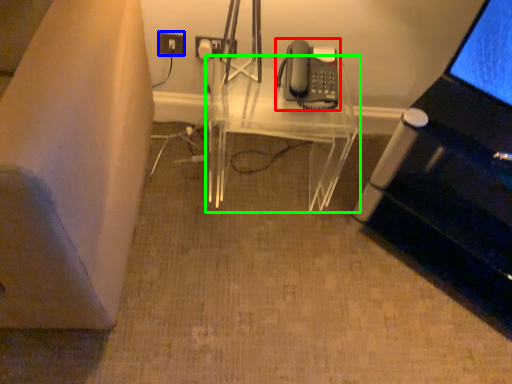
Question: Based on their relative distances, which object is nearer to corded phone (highlighted by a red box)? Choose from electric outlet (highlighted by a blue box) and table (highlighted by a green box).

Choices:
 (A) electric outlet
 (B) table

Answer: (B)